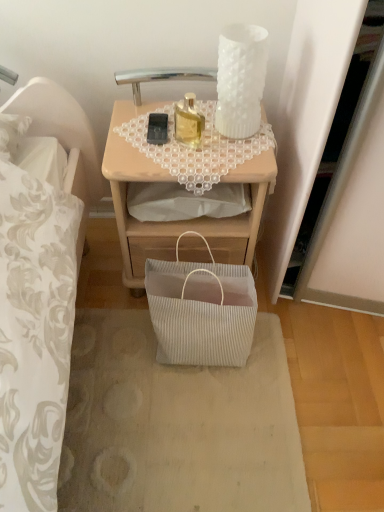
What do you see at coordinates (177, 221) in the screenshot?
I see `wooden desk at center` at bounding box center [177, 221].

Find the location of `black matte mobile phone at upper center`. black matte mobile phone at upper center is located at coordinates (157, 128).

From the image's perspective, is white pleated paper bag at lower center located above black matte mobile phone at upper center?

No, from the image's perspective, white pleated paper bag at lower center is not over black matte mobile phone at upper center.

Find the location of a particular element. This screenshot has width=384, height=512. plain in front of the black matte mobile phone at upper center is located at coordinates (177, 425).

Is point (86, 401) closer or farther from the camera than point (159, 138)?

Point (86, 401) is positioned farther from the camera compared to point (159, 138).

From a real-world perspective, is white pleated paper bag at lower center located higher than black matte mobile phone at upper center?

Incorrect, from a real-world perspective, white pleated paper bag at lower center is lower than black matte mobile phone at upper center.

Consider the image. Considering the relative sizes of translucent glass bottle at center and white pleated bag at lower center in the image provided, is translucent glass bottle at center shorter than white pleated bag at lower center?

Yes.

Is point (186, 96) positioned behind point (166, 345)?

No, (186, 96) is closer to viewer.

Is translucent glass bottle at center wider than white pleated bag at lower center?

Incorrect, the width of translucent glass bottle at center does not surpass that of white pleated bag at lower center.

Is white pleated paper bag at lower center shorter than translucent glass bottle at center?

Indeed, white pleated paper bag at lower center has a lesser height compared to translucent glass bottle at center.

From a real-world perspective, is white pleated paper bag at lower center physically located above or below translucent glass bottle at center?

Clearly, from a real-world perspective, white pleated paper bag at lower center is below translucent glass bottle at center.

Is white pleated paper bag at lower center facing away from translucent glass bottle at center?

No, white pleated paper bag at lower center is not facing away from translucent glass bottle at center.

Which object is further away from the camera taking this photo, white pleated paper bag at lower center or translucent glass bottle at center?

Positioned behind is white pleated paper bag at lower center.

From the picture: Considering the positions of objects translucent glass bottle at center and black matte mobile phone at upper center in the image provided, who is more to the left, translucent glass bottle at center or black matte mobile phone at upper center?

black matte mobile phone at upper center is more to the left.

Are translucent glass bottle at center and black matte mobile phone at upper center making contact?

Yes, translucent glass bottle at center is right next to black matte mobile phone at upper center and making contact.

I want to click on mobile phone that appears above the translucent glass bottle at center (from the image's perspective), so click(x=157, y=128).

In the scene shown: Is translucent glass bottle at center facing towards black matte mobile phone at upper center?

No.

Consider the image. Is wooden desk at center taller or shorter than white pleated bag at lower center?

Considering their sizes, wooden desk at center has more height than white pleated bag at lower center.

Based on their sizes in the image, would you say wooden desk at center is bigger or smaller than white pleated bag at lower center?

Clearly, wooden desk at center is larger in size than white pleated bag at lower center.

Can you tell me how much wooden desk at center and white pleated bag at lower center differ in facing direction?

wooden desk at center and white pleated bag at lower center are facing 1.5 degrees away from each other.

Between translucent glass bottle at center and wooden desk at center, which one has smaller size?

translucent glass bottle at center is smaller.

What's the angular difference between translucent glass bottle at center and wooden desk at center's facing directions?

The facing directions of translucent glass bottle at center and wooden desk at center are 19.6 degrees apart.

Considering the positions of objects translucent glass bottle at center and wooden desk at center in the image provided, who is more to the left, translucent glass bottle at center or wooden desk at center?

wooden desk at center.

At what (x,y) coordinates should I click in order to perform the action: click on bottle that appears above the wooden desk at center (from the image's perspective). Please return your answer as a coordinate pair (x, y). Image resolution: width=384 pixels, height=512 pixels. Looking at the image, I should click on (188, 121).

Does black matte mobile phone at upper center have a lesser width compared to white pleated bag at lower center?

Indeed, black matte mobile phone at upper center has a lesser width compared to white pleated bag at lower center.

Is black matte mobile phone at upper center positioned with its back to white pleated bag at lower center?

No, black matte mobile phone at upper center is not facing away from white pleated bag at lower center.

Does point (148, 130) appear closer or farther from the camera than point (244, 344)?

Point (148, 130) appears to be closer to the viewer than point (244, 344).

From the image's perspective, is black matte mobile phone at upper center beneath white pleated bag at lower center?

No.

At what (x,y) coordinates should I click in order to perform the action: click on plain below the black matte mobile phone at upper center (from a real-world perspective). Please return your answer as a coordinate pair (x, y). The image size is (384, 512). Looking at the image, I should click on (177, 425).

Locate an element on the screen. This screenshot has width=384, height=512. bottle to the left of white pleated bag at lower center is located at coordinates (188, 121).

Looking at the image, which one is located closer to wooden desk at center, black matte mobile phone at upper center or translucent glass bottle at center?

translucent glass bottle at center is positioned closer to the anchor wooden desk at center.

When comparing their distances from translucent glass bottle at center, does black matte mobile phone at upper center or white pleated bag at lower center seem further?

The object further to translucent glass bottle at center is white pleated bag at lower center.

Based on their spatial positions, is black matte mobile phone at upper center or wooden desk at center further from white pleated paper bag at lower center?

black matte mobile phone at upper center.

Considering their positions, is translucent glass bottle at center positioned further to white pleated bag at lower center than white pleated paper bag at lower center?

translucent glass bottle at center is positioned further to the anchor white pleated bag at lower center.

Estimate the real-world distances between objects in this image. Which object is further from white pleated paper bag at lower center, white pleated bag at lower center or wooden desk at center?

Based on the image, wooden desk at center appears to be further to white pleated paper bag at lower center.

When comparing their distances from white pleated paper bag at lower center, does translucent glass bottle at center or wooden desk at center seem further?

translucent glass bottle at center.

Looking at this image, estimate the real-world distances between objects in this image. Which object is closer to white pleated bag at lower center, white pleated paper bag at lower center or translucent glass bottle at center?

Based on the image, white pleated paper bag at lower center appears to be nearer to white pleated bag at lower center.

Which object lies nearer to the anchor point white pleated paper bag at lower center, white pleated bag at lower center or black matte mobile phone at upper center?

white pleated bag at lower center.

Locate an element on the screen. This screenshot has height=512, width=384. desk between black matte mobile phone at upper center and white pleated paper bag at lower center vertically is located at coordinates click(x=177, y=221).

Where is `desk between translucent glass bottle at center and white pleated bag at lower center vertically`? desk between translucent glass bottle at center and white pleated bag at lower center vertically is located at coordinates (177, 221).

The width and height of the screenshot is (384, 512). In order to click on desk between black matte mobile phone at upper center and white pleated bag at lower center in the up-down direction in this screenshot , I will do `click(177, 221)`.

You are a GUI agent. You are given a task and a screenshot of the screen. Output one action in this format:
    pyautogui.click(x=<x>, y=<y>)
    Task: Click on the desk between translucent glass bottle at center and white pleated paper bag at lower center from top to bottom
    Image resolution: width=384 pixels, height=512 pixels.
    Given the screenshot: What is the action you would take?
    pyautogui.click(x=177, y=221)